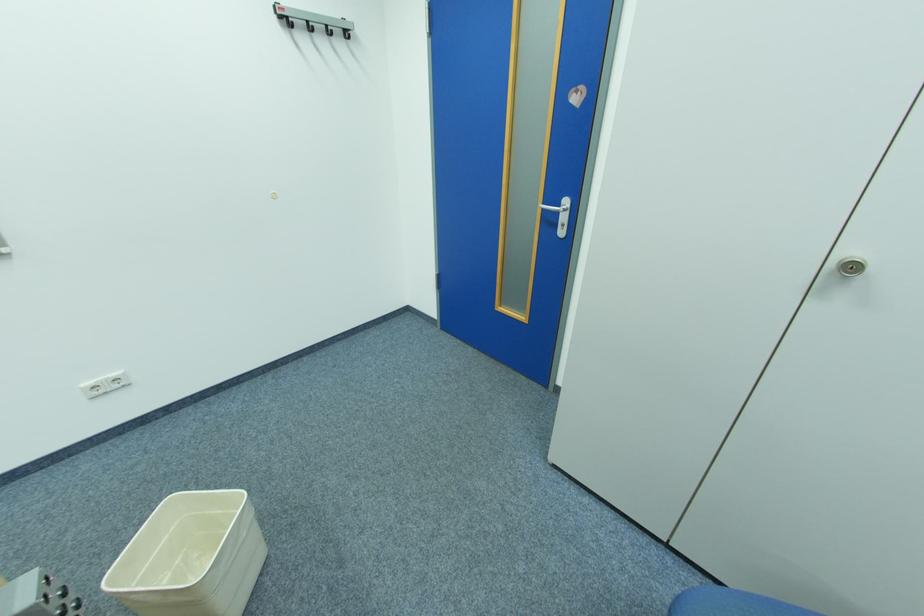
Where would you pull the silver door handle? Please return your answer as a coordinate pair (x, y).

(560, 215)